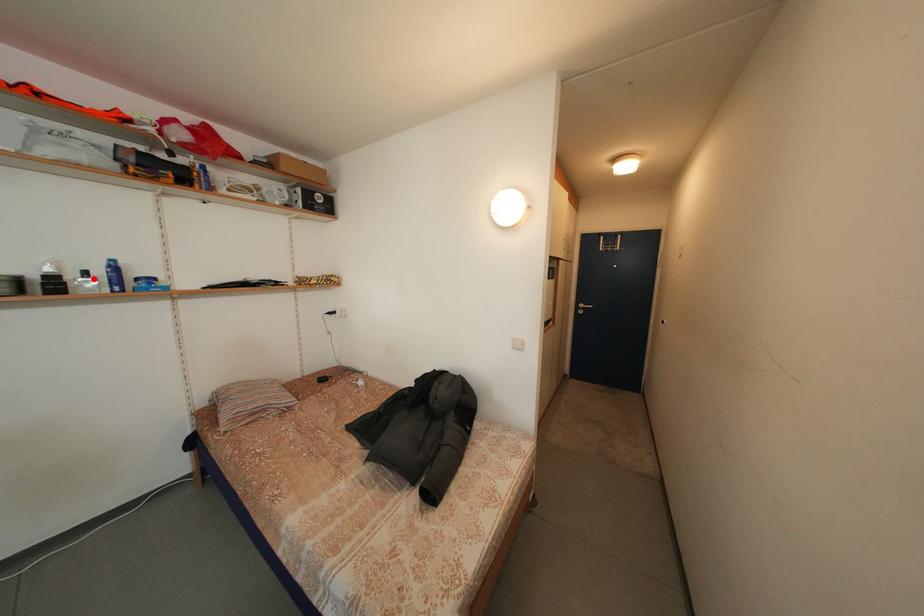
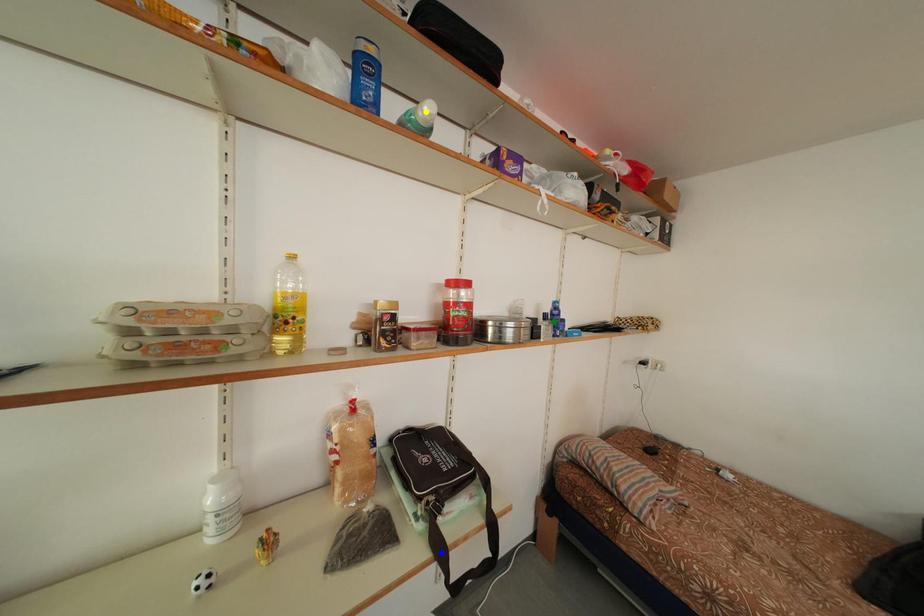
Question: I am providing you with two images of the same scene from different viewpoints. A red point is marked on the first image. You are given multiple points on the second image. In image 2, which mark is for the same physical point as the one in image 1?

Choices:
 (A) yellow point
 (B) green point
 (C) blue point

Answer: (B)